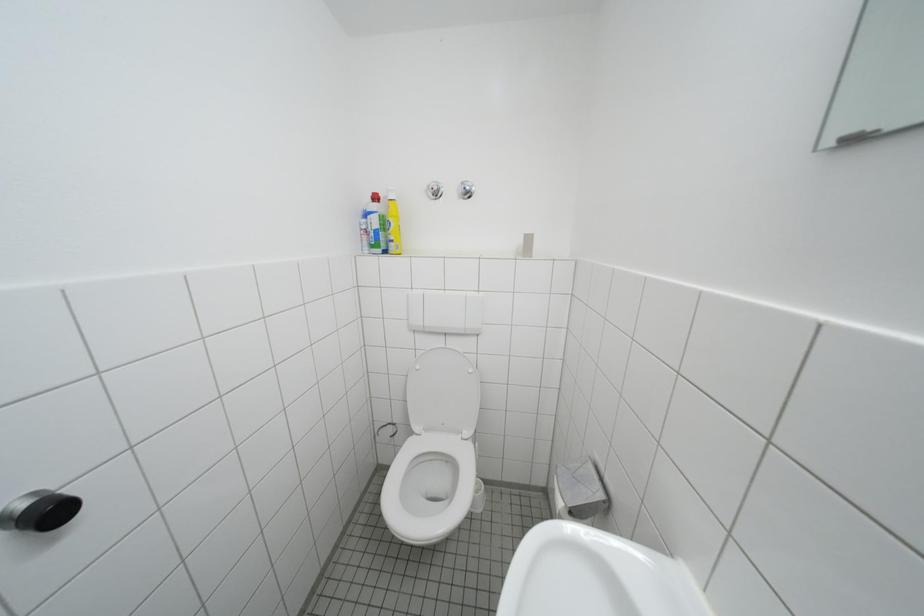
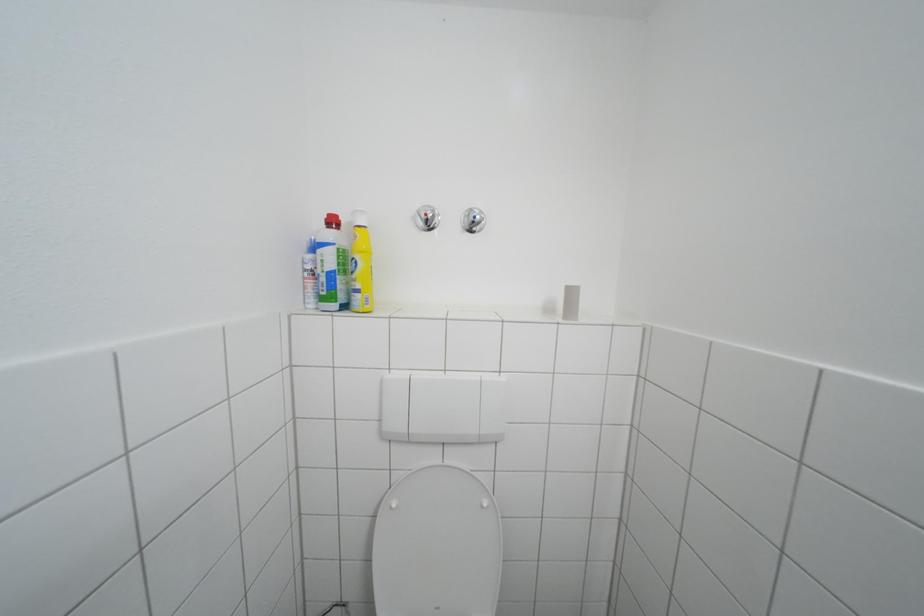
Question: How did the camera likely rotate?

Choices:
 (A) Left
 (B) Right
 (C) Up
 (D) Down

Answer: (B)